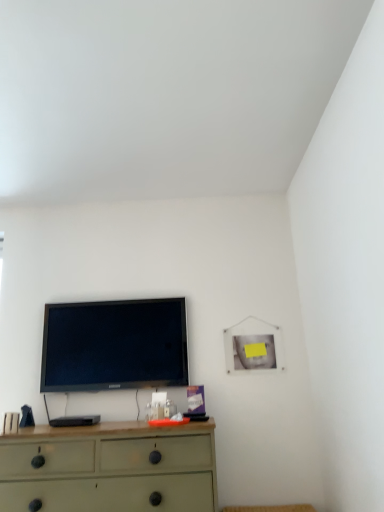
Question: From a real-world perspective, is black glossy tv at upper center above or below matte green dresser at lower center?

Choices:
 (A) below
 (B) above

Answer: (B)

Question: Is point (122, 305) closer or farther from the camera than point (99, 433)?

Choices:
 (A) farther
 (B) closer

Answer: (A)

Question: Considering the positions of black glossy tv at upper center and matte green dresser at lower center in the image, is black glossy tv at upper center wider or thinner than matte green dresser at lower center?

Choices:
 (A) thin
 (B) wide

Answer: (A)

Question: Is point (210, 470) positioned closer to the camera than point (167, 384)?

Choices:
 (A) closer
 (B) farther

Answer: (A)

Question: From the image's perspective, is matte green dresser at lower center above or below black glossy tv at upper center?

Choices:
 (A) above
 (B) below

Answer: (B)

Question: In the image, is matte green dresser at lower center positioned in front of or behind black glossy tv at upper center?

Choices:
 (A) behind
 (B) front

Answer: (B)

Question: Do you think matte green dresser at lower center is within black glossy tv at upper center, or outside of it?

Choices:
 (A) outside
 (B) inside

Answer: (A)